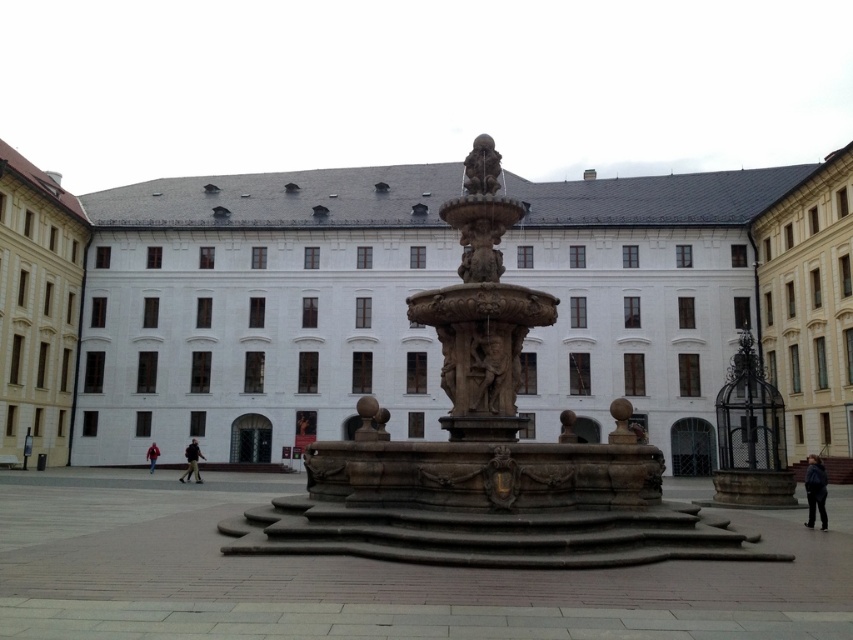
Measure the distance between brown stone fountain at center and camera.

brown stone fountain at center and camera are 18.49 meters apart.

You are a GUI agent. You are given a task and a screenshot of the screen. Output one action in this format:
    pyautogui.click(x=<x>, y=<y>)
    Task: Click on the brown stone fountain at center
    
    Given the screenshot: What is the action you would take?
    pyautogui.click(x=369, y=576)

Locate an element on the screen. This screenshot has height=640, width=853. brown stone fountain at center is located at coordinates (369, 576).

Is white stone building at left above black fabric person at center?

Yes.

Looking at this image, who is more distant from viewer, (x=78, y=227) or (x=200, y=483)?

The point (x=78, y=227) is more distant.

This screenshot has width=853, height=640. What do you see at coordinates (38, 308) in the screenshot?
I see `white stone building at left` at bounding box center [38, 308].

At what (x,y) coordinates should I click in order to perform the action: click on white stone building at left. Please return your answer as a coordinate pair (x, y). Looking at the image, I should click on (38, 308).

Is point (473, 176) positioned before point (152, 452)?

Yes, it is.

This screenshot has width=853, height=640. Identify the location of polished stone sculpture at center. (480, 166).